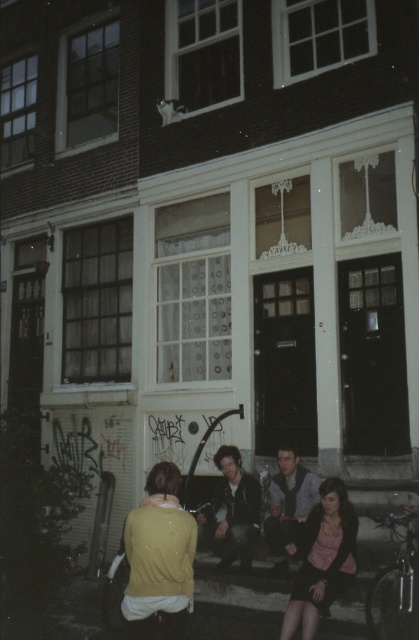
Who is positioned more to the right, dark gray leather jacket at center or gray textured vest at center?

Positioned to the right is gray textured vest at center.

Based on the photo, who is shorter, dark gray leather jacket at center or gray textured vest at center?

dark gray leather jacket at center

Identify the location of dark gray leather jacket at center. This screenshot has height=640, width=419. (232, 512).